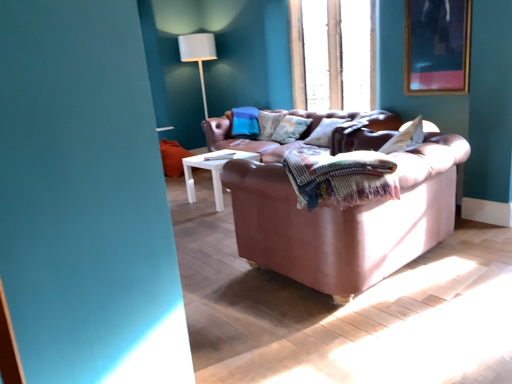
Question: In terms of size, does wooden-framed artwork at upper right appear bigger or smaller than woven multicolored blanket at center?

Choices:
 (A) small
 (B) big

Answer: (A)

Question: Choose the correct answer: Is wooden-framed artwork at upper right inside woven multicolored blanket at center or outside it?

Choices:
 (A) outside
 (B) inside

Answer: (A)

Question: Considering the real-world distances, which object is closest to the leather couch at center?

Choices:
 (A) woven multicolored blanket at center
 (B) textured beige pillow at center
 (C) wooden at upper center
 (D) wooden-framed artwork at upper right
 (E) white fabric lampshade at upper center

Answer: (A)

Question: Based on their relative distances, which object is nearer to the textured beige pillow at center?

Choices:
 (A) white fabric lampshade at upper center
 (B) wooden at upper center
 (C) woven multicolored blanket at center
 (D) leather couch at center
 (E) wooden-framed artwork at upper right

Answer: (B)